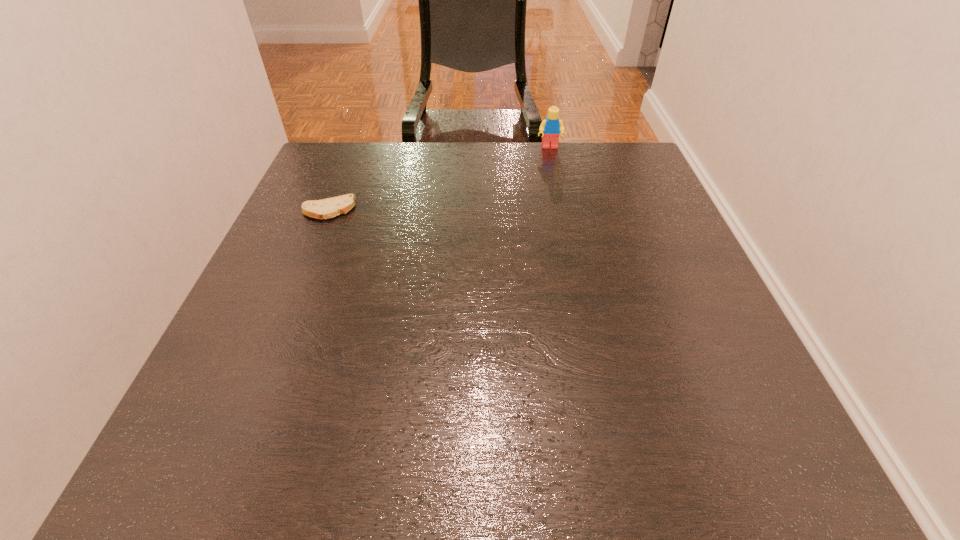
In the image, there is a desktop. In order to click on vacant space at the right edge in this screenshot , I will do `click(639, 269)`.

Where is `vacant area at the far left corner of the desktop`? This screenshot has width=960, height=540. vacant area at the far left corner of the desktop is located at coordinates (334, 147).

The width and height of the screenshot is (960, 540). In the image, there is a desktop. Identify the location of blank space at the far right corner. (605, 170).